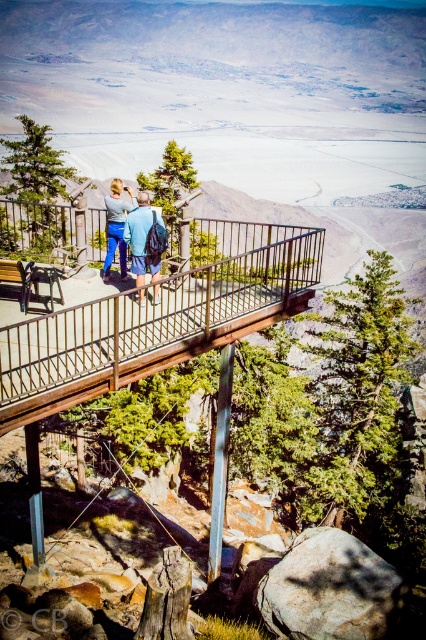
Question: Can you confirm if blue fabric backpack at center is thinner than matte blue jeans at center?

Choices:
 (A) no
 (B) yes

Answer: (A)

Question: Based on their relative distances, which object is nearer to the blue fabric backpack at center?

Choices:
 (A) matte blue jeans at center
 (B) wooden rail at center

Answer: (A)

Question: Which of these objects is positioned closest to the wooden rail at center?

Choices:
 (A) matte blue jeans at center
 (B) blue fabric backpack at center

Answer: (B)

Question: Is wooden rail at center to the left of matte blue jeans at center from the viewer's perspective?

Choices:
 (A) yes
 (B) no

Answer: (B)

Question: Does blue fabric backpack at center come behind matte blue jeans at center?

Choices:
 (A) no
 (B) yes

Answer: (A)

Question: Which point is farther from the camera taking this photo?

Choices:
 (A) (123, 200)
 (B) (31, 337)
 (C) (146, 202)

Answer: (A)